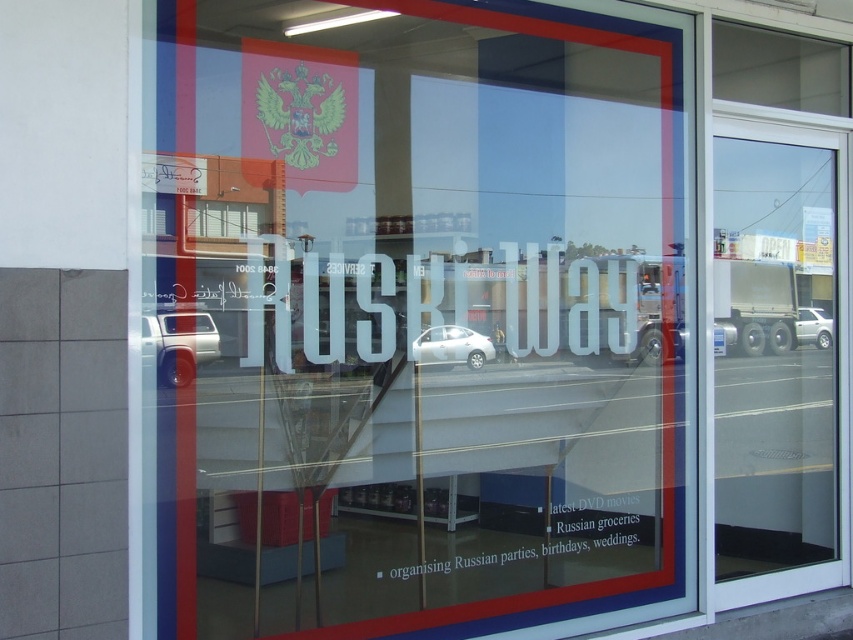
Question: Does silver metallic truck at left have a greater width compared to white glossy car at center?

Choices:
 (A) no
 (B) yes

Answer: (A)

Question: Can you confirm if transparent glass sign at center is bigger than transparent glass door at right?

Choices:
 (A) yes
 (B) no

Answer: (A)

Question: Among these points, which one is nearest to the camera?

Choices:
 (A) (813, 372)
 (B) (181, 324)
 (C) (486, 342)
 (D) (811, 324)

Answer: (B)

Question: Does white glossy car at center come in front of silver metallic car at right?

Choices:
 (A) no
 (B) yes

Answer: (B)

Question: Among these points, which one is farthest from the camera?

Choices:
 (A) (479, 45)
 (B) (816, 337)

Answer: (B)

Question: Which of the following is the farthest from the observer?

Choices:
 (A) transparent glass door at right
 (B) silver metallic car at right

Answer: (B)